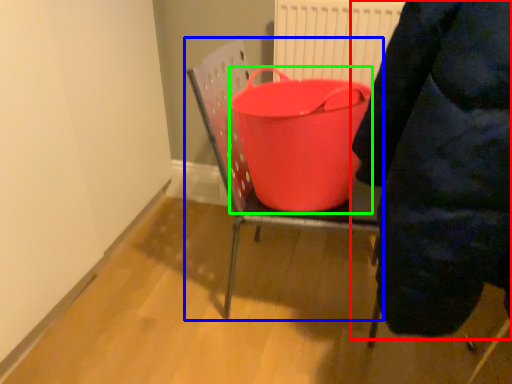
Question: Which object is positioned farthest from person (highlighted by a red box)? Select from furniture (highlighted by a blue box) and basin (highlighted by a green box).

Choices:
 (A) furniture
 (B) basin

Answer: (A)